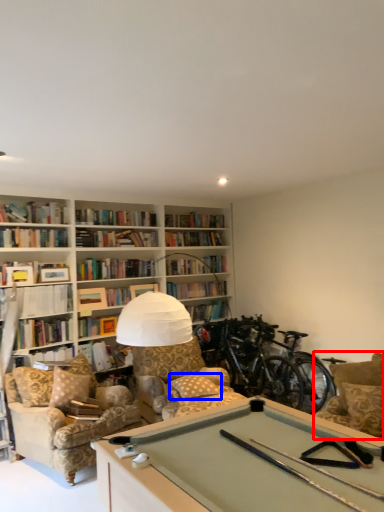
Question: Which object appears farthest to the camera in this image, armchair (highlighted by a red box) or pillow (highlighted by a blue box)?

Choices:
 (A) armchair
 (B) pillow

Answer: (B)